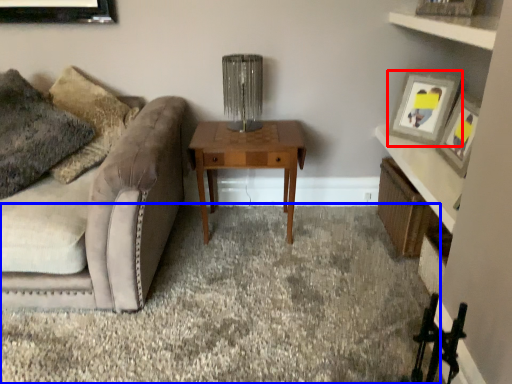
Question: Which point is closer to the camera, picture frame (highlighted by a red box) or plain (highlighted by a blue box)?

Choices:
 (A) picture frame
 (B) plain

Answer: (B)